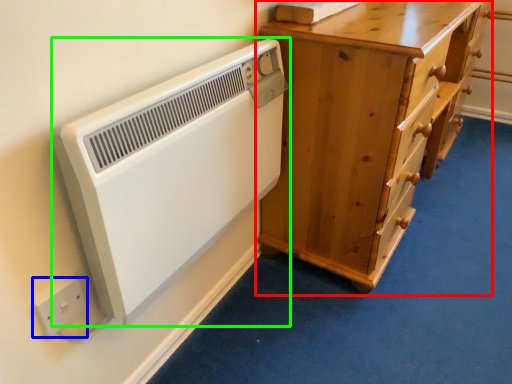
Question: Which object is the farthest from chest of drawers (highlighted by a red box)? Choose among these: electric outlet (highlighted by a blue box) or home appliance (highlighted by a green box).

Choices:
 (A) electric outlet
 (B) home appliance

Answer: (A)